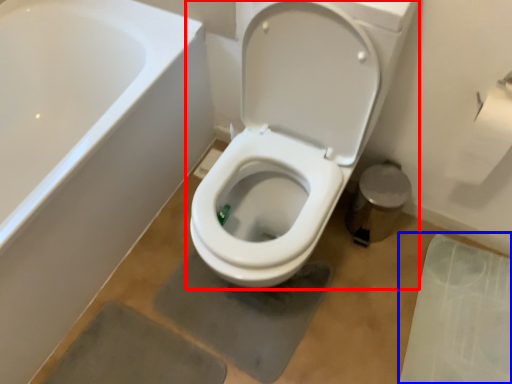
Question: Which point is further to the camera, toilet (highlighted by a red box) or concrete (highlighted by a blue box)?

Choices:
 (A) toilet
 (B) concrete

Answer: (B)